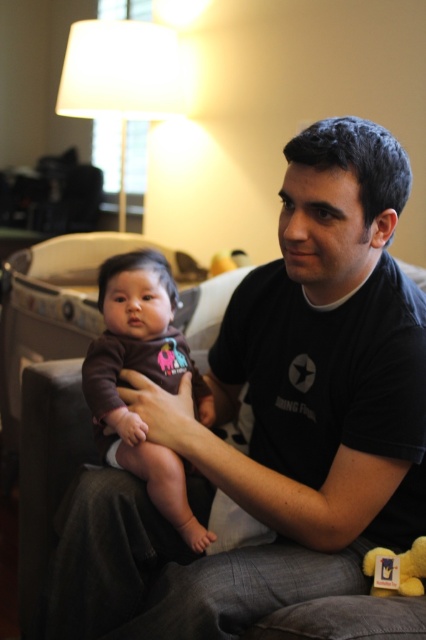
Who is more forward, (412, 484) or (147, 369)?

Point (412, 484) is in front.

Does black cotton shirt at center have a greater width compared to brown soft fabric baby at center?

Yes.

Measure the distance between black cotton shirt at center and camera.

They are 94.18 centimeters apart.

Identify the location of black cotton shirt at center. (276, 420).

Does brown soft fabric baby at center appear under yellow plush bear at lower right?

Actually, brown soft fabric baby at center is above yellow plush bear at lower right.

Is brown soft fabric baby at center wider than yellow plush bear at lower right?

Indeed, brown soft fabric baby at center has a greater width compared to yellow plush bear at lower right.

Between point (108, 397) and point (383, 595), which one is positioned behind?

Positioned behind is point (108, 397).

This screenshot has height=640, width=426. Identify the location of brown soft fabric baby at center. (146, 376).

Is black cotton shirt at center below white fabric lampshade at upper center?

Yes.

Between black cotton shirt at center and white fabric lampshade at upper center, which one appears on the left side from the viewer's perspective?

Positioned to the left is white fabric lampshade at upper center.

Who is more forward, (227, 355) or (66, 72)?

Point (227, 355) is in front.

What are the coordinates of `black cotton shirt at center` in the screenshot? It's located at (276, 420).